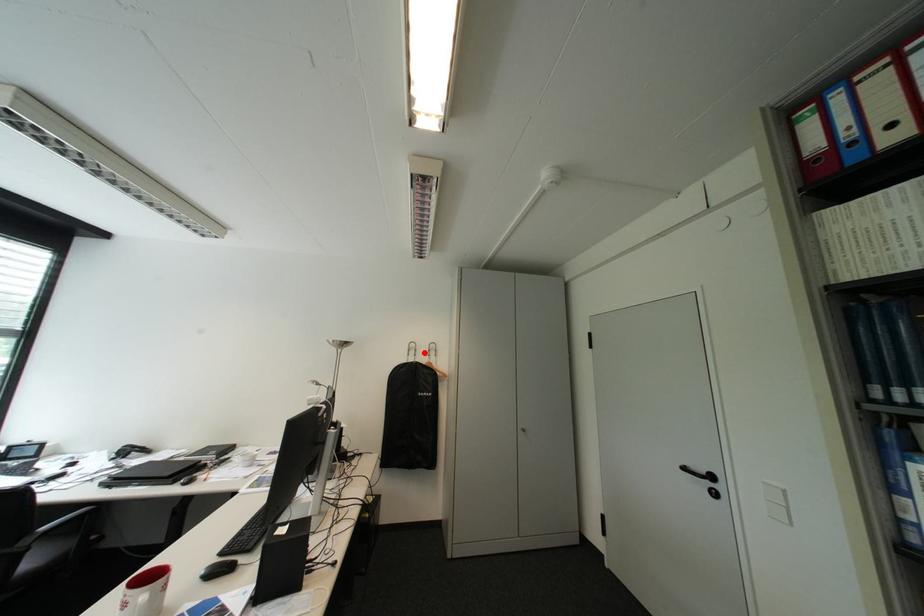
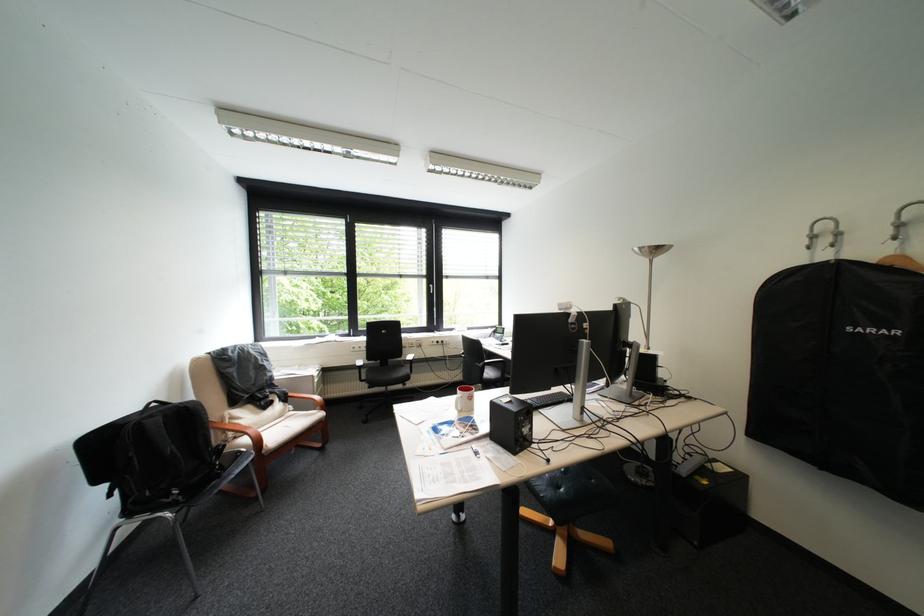
Find the pixel in the second image that matches the highlighted location in the first image.

(837, 241)